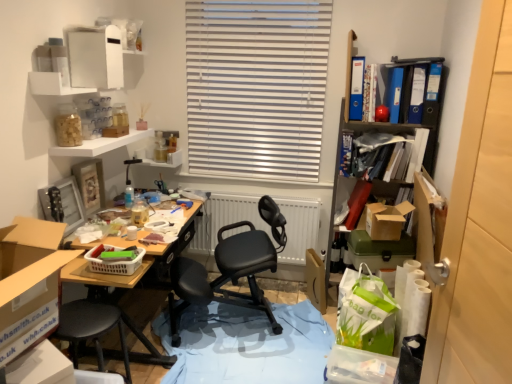
Question: Does blue glossy file at upper right, which is the sixth book from left to right, have a larger size compared to blue plastic ring binder at upper right, placed as the 6th book when sorted from right to left?

Choices:
 (A) yes
 (B) no

Answer: (A)

Question: Are blue glossy file at upper right, which is the sixth book from left to right, and blue plastic ring binder at upper right, placed as the second book when sorted from left to right, far apart?

Choices:
 (A) no
 (B) yes

Answer: (A)

Question: From a real-world perspective, is blue glossy file at upper right, which is the sixth book from left to right, under blue plastic ring binder at upper right, placed as the second book when sorted from left to right?

Choices:
 (A) no
 (B) yes

Answer: (B)

Question: Is blue plastic ring binder at upper right, placed as the second book when sorted from left to right, at the back of blue glossy file at upper right, which is the 2th book in right-to-left order?

Choices:
 (A) yes
 (B) no

Answer: (B)

Question: Is blue glossy file at upper right, which is the 2th book in right-to-left order, further to camera compared to blue plastic ring binder at upper right, placed as the second book when sorted from left to right?

Choices:
 (A) no
 (B) yes

Answer: (A)

Question: Looking at their shapes, would you say blue glossy file at upper right, which is the 2th book in right-to-left order, is wider or thinner than cardboard box at left, which appears as the second box when viewed from the right?

Choices:
 (A) thin
 (B) wide

Answer: (A)

Question: In terms of size, does blue glossy file at upper right, which is the 2th book in right-to-left order, appear bigger or smaller than cardboard box at left, which ranks as the 1th box in left-to-right order?

Choices:
 (A) big
 (B) small

Answer: (B)

Question: In the image, is blue glossy file at upper right, which is the 2th book in right-to-left order, positioned in front of or behind cardboard box at left, the 1th box viewed from the front?

Choices:
 (A) front
 (B) behind

Answer: (B)

Question: From a real-world perspective, relative to cardboard box at left, the 1th box viewed from the front, is blue glossy file at upper right, which is the 2th book in right-to-left order, vertically above or below?

Choices:
 (A) below
 (B) above

Answer: (B)

Question: In the image, is blue matte book at upper right, placed as the 7th book when sorted from right to left, positioned in front of or behind blue glossy file at upper right, which is the 2th book in right-to-left order?

Choices:
 (A) front
 (B) behind

Answer: (B)

Question: Does point (344, 152) appear closer or farther from the camera than point (420, 112)?

Choices:
 (A) closer
 (B) farther

Answer: (B)

Question: Which is correct: blue matte book at upper right, acting as the 1th book starting from the left, is inside blue glossy file at upper right, which is the 2th book in right-to-left order, or outside of it?

Choices:
 (A) inside
 (B) outside

Answer: (B)

Question: Is blue matte book at upper right, acting as the 1th book starting from the left, wider or thinner than blue glossy file at upper right, which is the sixth book from left to right?

Choices:
 (A) thin
 (B) wide

Answer: (B)

Question: From their relative heights in the image, would you say cardboard box at left, which appears as the second box when viewed from the right, is taller or shorter than black leather office chair at center?

Choices:
 (A) tall
 (B) short

Answer: (B)

Question: Relative to black leather office chair at center, is cardboard box at left, the 1th box viewed from the front, in front or behind?

Choices:
 (A) behind
 (B) front

Answer: (B)